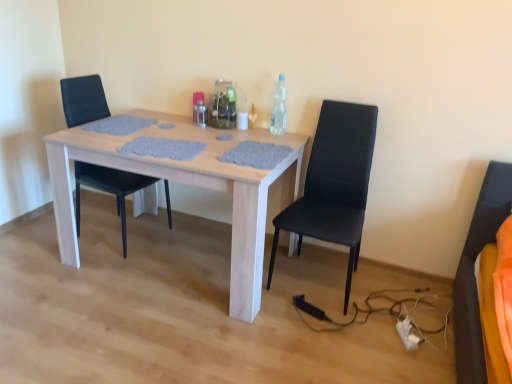
The height and width of the screenshot is (384, 512). Find the location of `free space that is in between light wood table at center and black leather chair at right, arranged as the second chair when viewed from the left`. free space that is in between light wood table at center and black leather chair at right, arranged as the second chair when viewed from the left is located at coordinates pos(289,316).